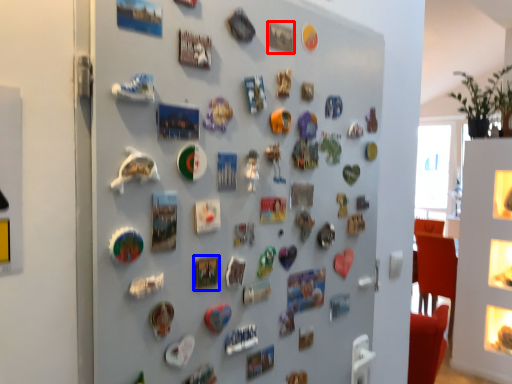
Question: Which object is closer to the camera taking this photo, button (highlighted by a red box) or button (highlighted by a blue box)?

Choices:
 (A) button
 (B) button

Answer: (B)